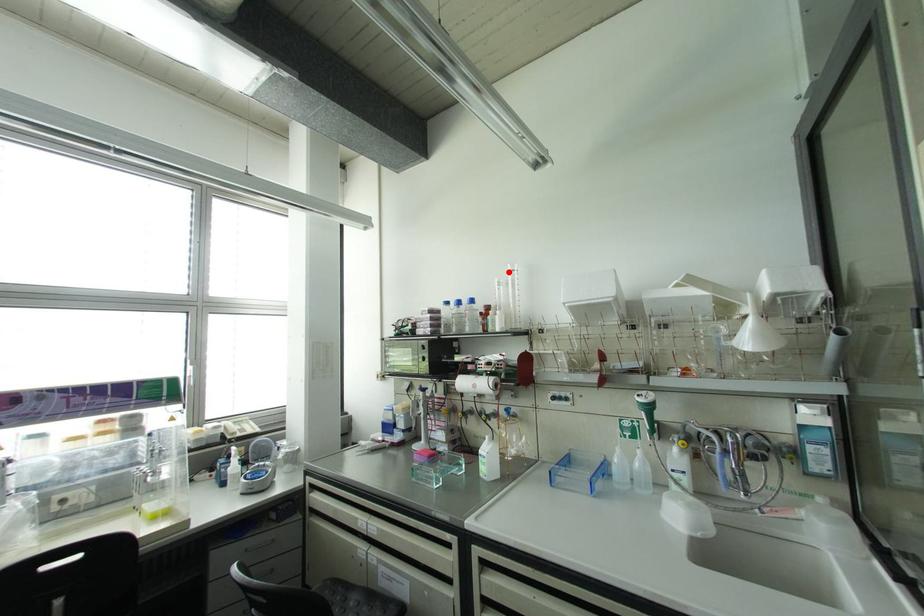
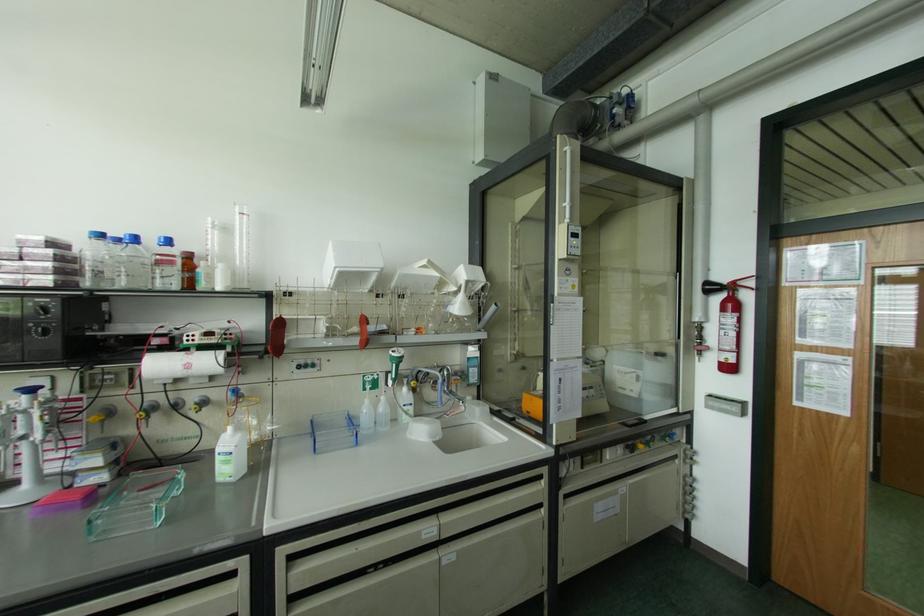
Question: I am providing you with two images of the same scene from different viewpoints. A red point is marked on the first image. Can you still see the location of the red point in image 2?

Choices:
 (A) Yes
 (B) No

Answer: (A)